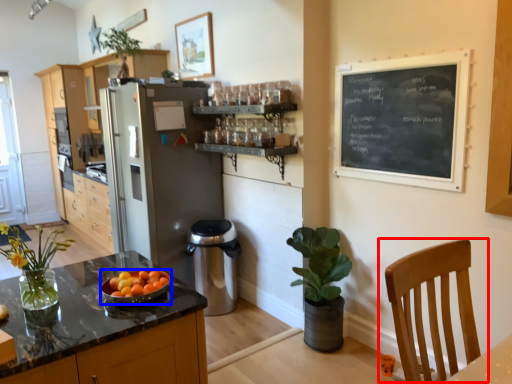
Question: Which of the following is the farthest to the observer, chair (highlighted by a red box) or kitchen appliance (highlighted by a blue box)?

Choices:
 (A) chair
 (B) kitchen appliance

Answer: (B)